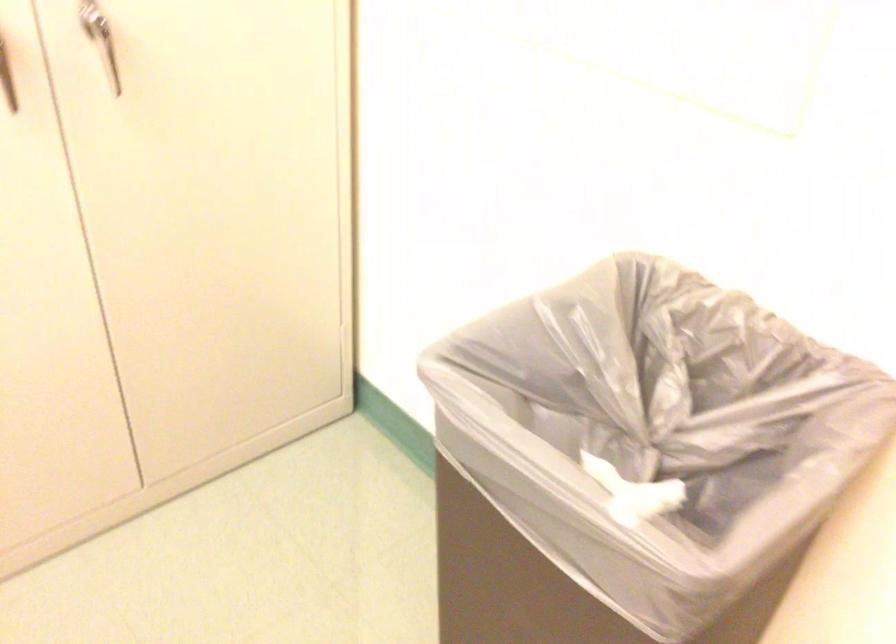
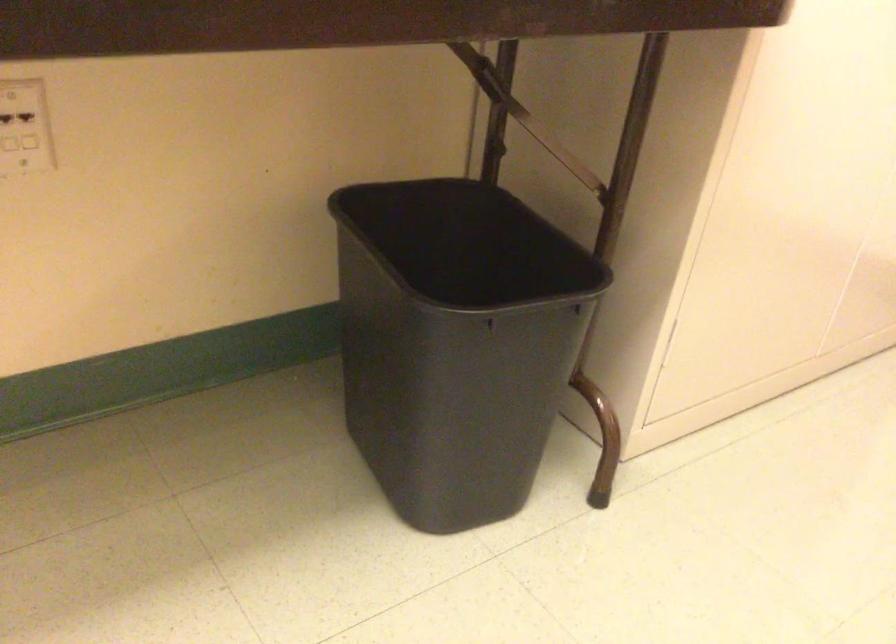
Question: The images are taken continuously from a first-person perspective. In which direction are you moving?

Choices:
 (A) Left
 (B) Right
 (C) Forward
 (D) Backward

Answer: (A)